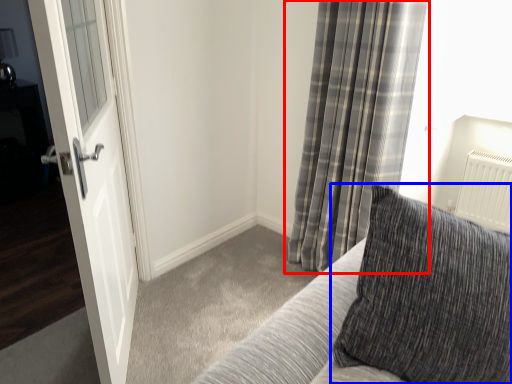
Question: Which object is closer to the camera taking this photo, curtain (highlighted by a red box) or pillow (highlighted by a blue box)?

Choices:
 (A) curtain
 (B) pillow

Answer: (B)